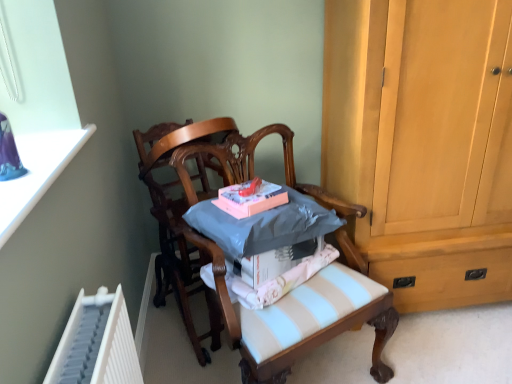
Question: From a real-world perspective, relative to light brown wood cabinet at right, is pink matte book at center vertically above or below?

Choices:
 (A) below
 (B) above

Answer: (B)

Question: Considering the positions of pink matte book at center and light brown wood cabinet at right in the image, is pink matte book at center wider or thinner than light brown wood cabinet at right?

Choices:
 (A) wide
 (B) thin

Answer: (B)

Question: Which of these objects is positioned farthest from the pink matte book at center?

Choices:
 (A) light blue striped fabric at center
 (B) light brown wood cabinet at right
 (C) wooden chair at center, the 1th chair in the left-to-right sequence
 (D) wooden chair at center, the 2th chair viewed from the left

Answer: (B)

Question: Which of these objects is positioned farthest from the pink matte book at center?

Choices:
 (A) wooden chair at center, the second chair positioned from the right
 (B) wooden chair at center, marked as the 1th chair in a right-to-left arrangement
 (C) light blue striped fabric at center
 (D) light brown wood cabinet at right

Answer: (D)